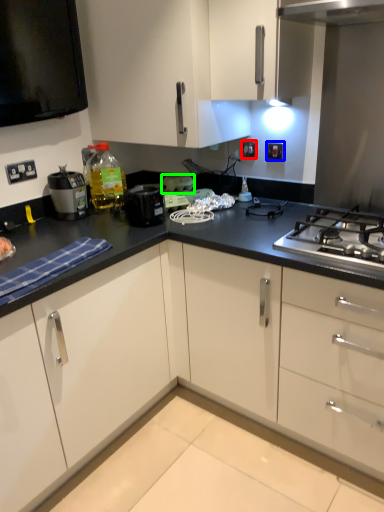
Question: Based on their relative distances, which object is nearer to electric outlet (highlighted by a red box)? Choose from electric outlet (highlighted by a blue box) and appliance (highlighted by a green box).

Choices:
 (A) electric outlet
 (B) appliance

Answer: (A)